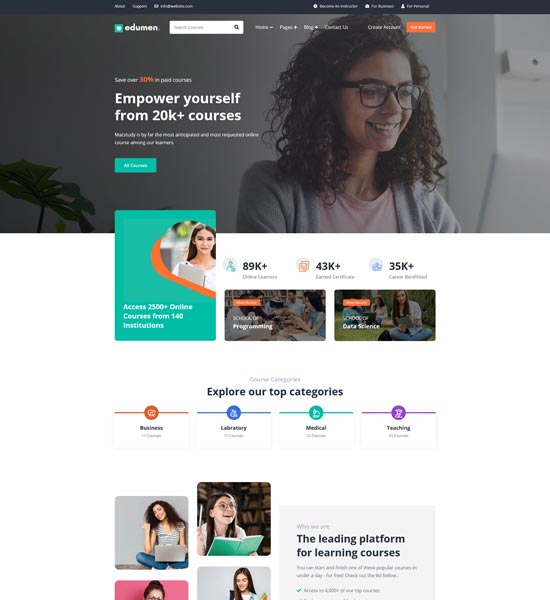
Image resolution: width=550 pixels, height=600 pixels. What are the coordinates of `green book` in the screenshot? It's located at (241, 546).